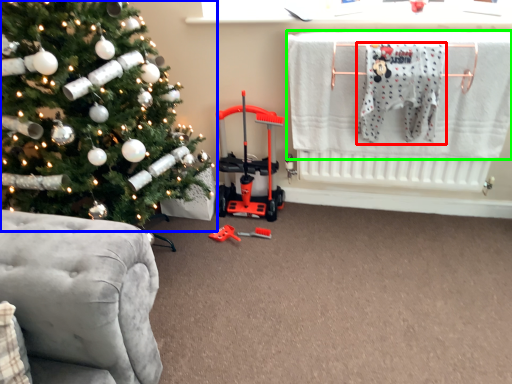
Question: Which object is positioned farthest from baby clothe (highlighted by a red box)? Select from christmas tree (highlighted by a blue box) and laundry (highlighted by a green box).

Choices:
 (A) christmas tree
 (B) laundry

Answer: (A)